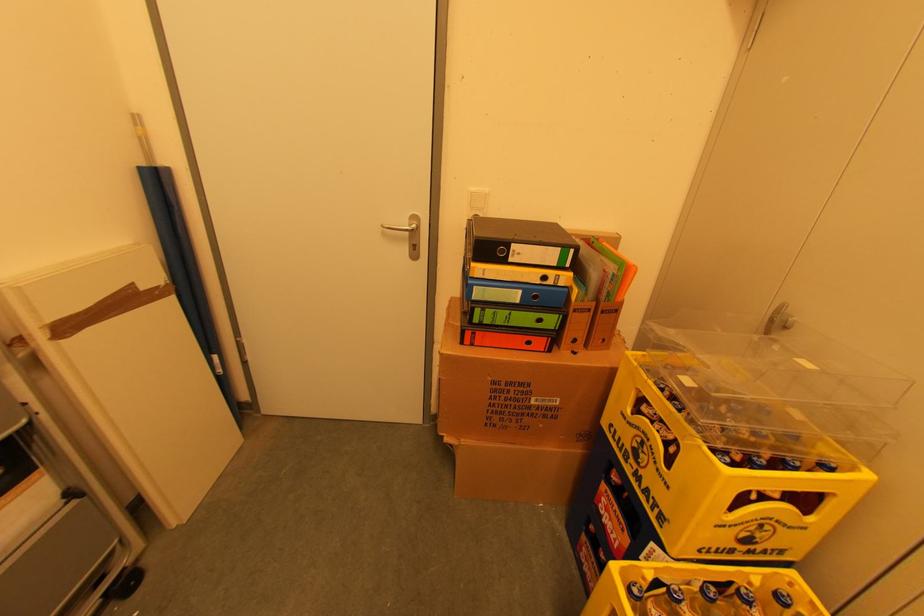
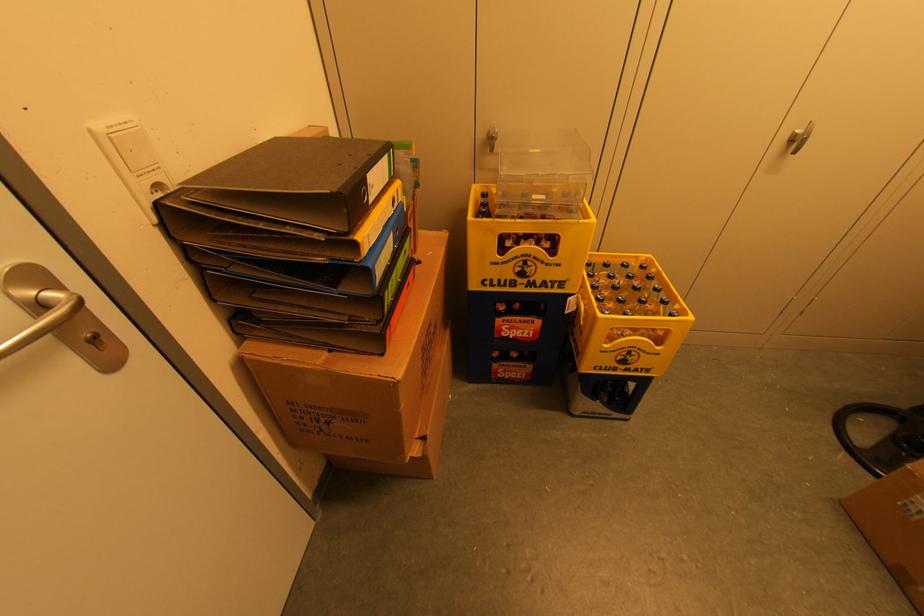
The point at (517, 252) is marked in the first image. Where is the corresponding point in the second image?

(371, 185)